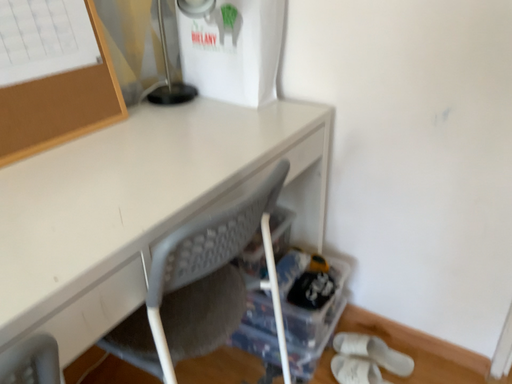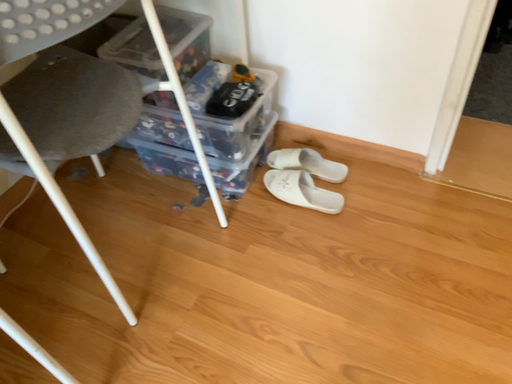
Question: How did the camera likely rotate when shooting the video?

Choices:
 (A) rotated downward
 (B) rotated upward

Answer: (A)